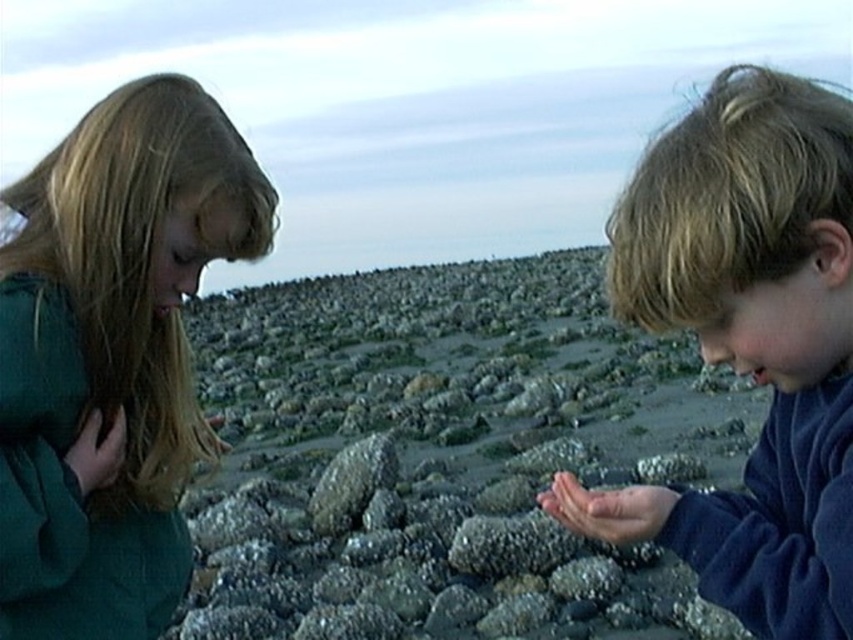
Question: Which of the following is the farthest from the observer?

Choices:
 (A) green matte shirt at left
 (B) smooth skin hand at lower center
 (C) smooth gray rocks at center

Answer: (C)

Question: Does smooth gray rocks at center have a greater width compared to smooth skin hand at lower center?

Choices:
 (A) no
 (B) yes

Answer: (B)

Question: Is gray rough rock at center below matte green hand at lower left?

Choices:
 (A) no
 (B) yes

Answer: (B)

Question: Where is smooth gray rocks at center located in relation to smooth brown hair at center in the image?

Choices:
 (A) above
 (B) below

Answer: (A)

Question: Which of the following is the closest to the observer?

Choices:
 (A) (67, 452)
 (B) (323, 474)
 (C) (70, 232)

Answer: (A)

Question: Among these objects, which one is nearest to the camera?

Choices:
 (A) smooth gray rocks at center
 (B) green matte shirt at left

Answer: (B)